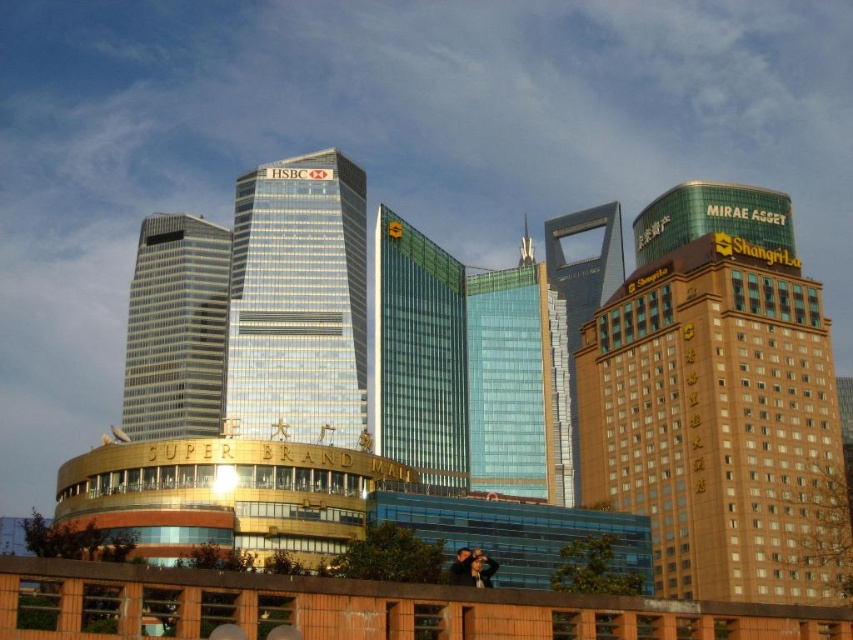
Can you confirm if glassy metallic skyscraper at center is positioned below silver glass skyscraper at center?

Incorrect, glassy metallic skyscraper at center is not positioned below silver glass skyscraper at center.

Between glassy metallic skyscraper at center and silver glass skyscraper at center, which one is positioned lower?

silver glass skyscraper at center is below.

Where is `glassy metallic skyscraper at center`? This screenshot has width=853, height=640. glassy metallic skyscraper at center is located at coordinates (299, 301).

Can you confirm if green glass skyscraper at center is bigger than transparent glass tower at center?

Yes, green glass skyscraper at center is bigger than transparent glass tower at center.

What are the coordinates of `green glass skyscraper at center` in the screenshot? It's located at (518, 384).

From the picture: Can you confirm if brown brick hotel at right is positioned above green glass skyscraper at center?

No.

Is brown brick hotel at right taller than green glass skyscraper at center?

Incorrect, brown brick hotel at right's height is not larger of green glass skyscraper at center's.

Where is `brown brick hotel at right`? This screenshot has width=853, height=640. brown brick hotel at right is located at coordinates (718, 403).

I want to click on brown brick hotel at right, so click(718, 403).